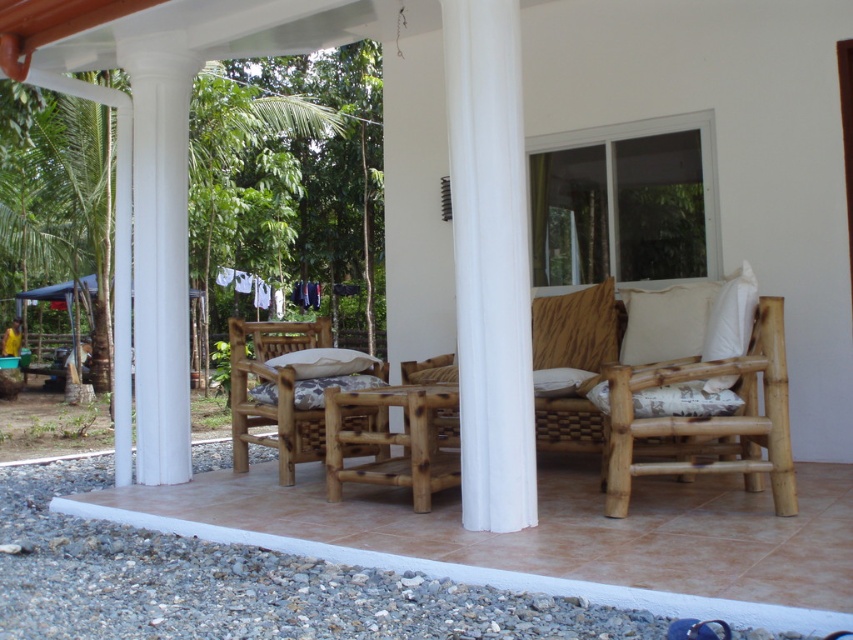
Between natural wood rocking chair at center and white soft cushion at center, which one appears on the right side from the viewer's perspective?

white soft cushion at center

Does point (247, 461) lie behind point (276, 360)?

Yes, it is behind point (276, 360).

Is point (323, 438) positioned after point (358, 355)?

No.

Find the location of a particular element. natural wood rocking chair at center is located at coordinates (277, 392).

Does brown bamboo porch at lower left lie in front of white textured pillow at center?

That is True.

Does brown bamboo porch at lower left have a smaller size compared to white textured pillow at center?

No, brown bamboo porch at lower left is not smaller than white textured pillow at center.

Is point (402, 556) positioned in front of point (730, 412)?

That is True.

The height and width of the screenshot is (640, 853). I want to click on brown bamboo porch at lower left, so click(x=544, y=538).

Who is taller, white smooth column at center or natural wood rocking chair at center?

white smooth column at center

You are a GUI agent. You are given a task and a screenshot of the screen. Output one action in this format:
    pyautogui.click(x=<x>, y=<y>)
    Task: Click on the white smooth column at center
    This screenshot has width=853, height=640.
    Given the screenshot: What is the action you would take?
    pyautogui.click(x=490, y=262)